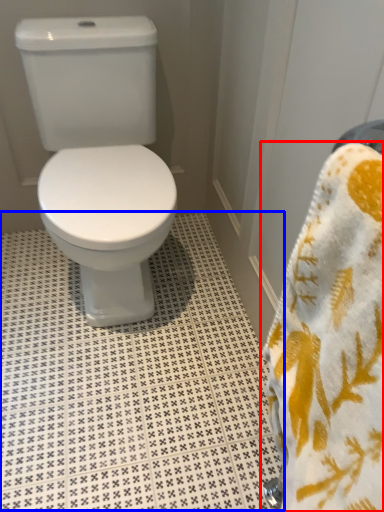
Question: Which object is closer to the camera taking this photo, towel (highlighted by a red box) or tile (highlighted by a blue box)?

Choices:
 (A) towel
 (B) tile

Answer: (A)